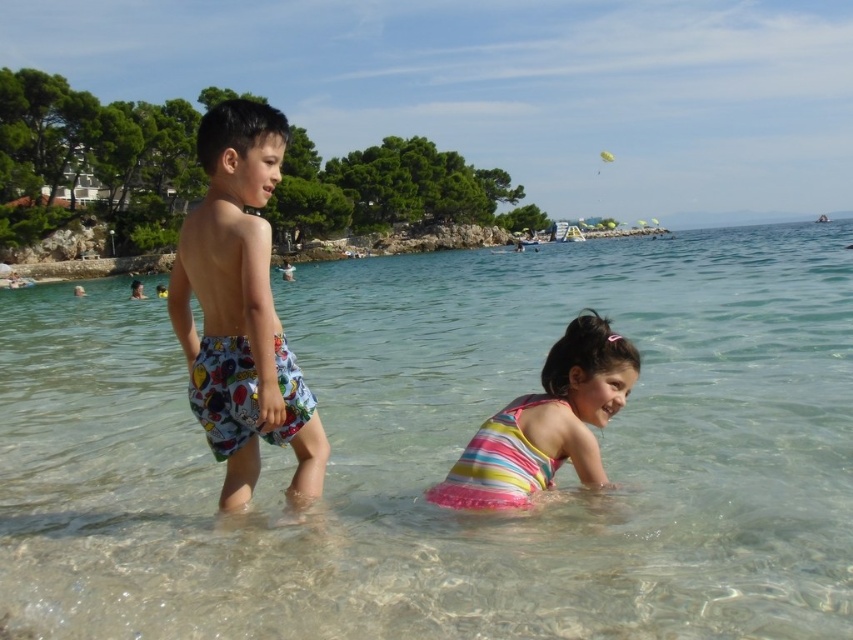
Question: Among these objects, which one is nearest to the camera?

Choices:
 (A) clear water at center
 (B) striped fabric swimsuit at lower center

Answer: (A)

Question: Does clear water at center come behind striped fabric swimsuit at lower center?

Choices:
 (A) yes
 (B) no

Answer: (B)

Question: Which object appears farthest from the camera in this image?

Choices:
 (A) clear water at center
 (B) printed fabric shorts at left

Answer: (B)

Question: Estimate the real-world distances between objects in this image. Which object is closer to the clear water at center?

Choices:
 (A) printed fabric shorts at left
 (B) striped fabric swimsuit at lower center

Answer: (B)

Question: Is printed fabric shorts at left thinner than striped fabric swimsuit at lower center?

Choices:
 (A) no
 (B) yes

Answer: (B)

Question: Is the position of clear water at center less distant than that of striped fabric swimsuit at lower center?

Choices:
 (A) yes
 (B) no

Answer: (A)